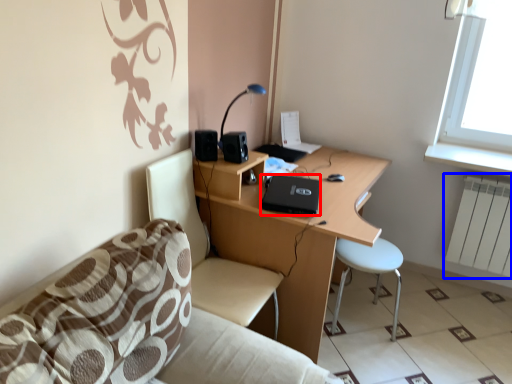
Question: Among these objects, which one is nearest to the camera, laptop (highlighted by a red box) or radiator (highlighted by a blue box)?

Choices:
 (A) laptop
 (B) radiator

Answer: (A)